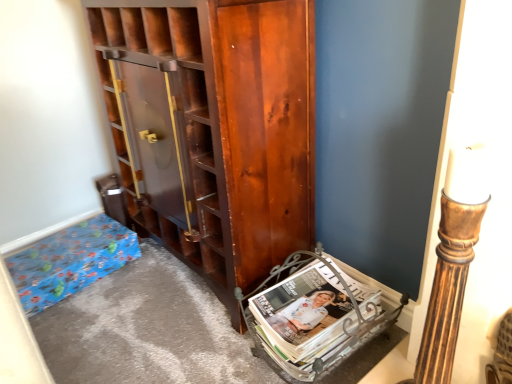
Locate an element on the screen. free space in front of blue paper bag at lower left is located at coordinates (82, 320).